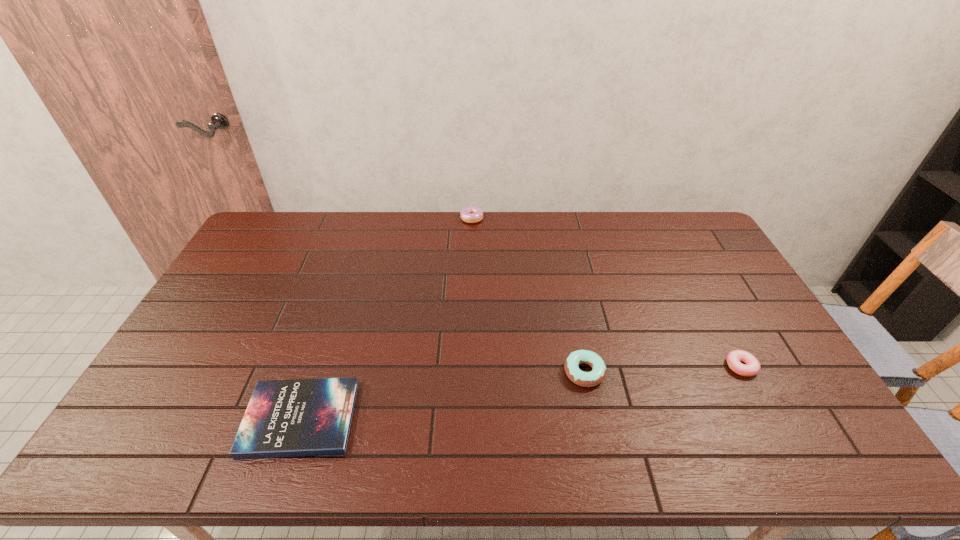
In order to click on empty space between the shortest object and the second object from right to left in this screenshot , I will do `click(443, 395)`.

I want to click on free space between the leftmost object and the third object from left to right, so click(x=443, y=395).

Identify the location of blank region between the rightmost object and the hardback book. The height and width of the screenshot is (540, 960). (520, 393).

The height and width of the screenshot is (540, 960). Identify the location of free spot between the farthest object and the second doughnut from right to left. (528, 295).

The width and height of the screenshot is (960, 540). In order to click on free spot between the third object from left to right and the leftmost object in this screenshot , I will do `click(443, 395)`.

At what (x,y) coordinates should I click in order to perform the action: click on free space between the leftmost doughnut and the second doughnut from right to left. Please return your answer as a coordinate pair (x, y). Looking at the image, I should click on (528, 295).

You are a GUI agent. You are given a task and a screenshot of the screen. Output one action in this format:
    pyautogui.click(x=<x>, y=<y>)
    Task: Click on the free space between the hardback book and the second object from right to left
    The image size is (960, 540).
    Given the screenshot: What is the action you would take?
    pyautogui.click(x=443, y=395)

Identify the location of object identified as the third closest to the farthest doughnut. The width and height of the screenshot is (960, 540). (752, 367).

Identify the location of object that is the closest to the shortest object. (587, 379).

Image resolution: width=960 pixels, height=540 pixels. Identify the location of doughnut that is the second nearest to the rightmost doughnut. (471, 214).